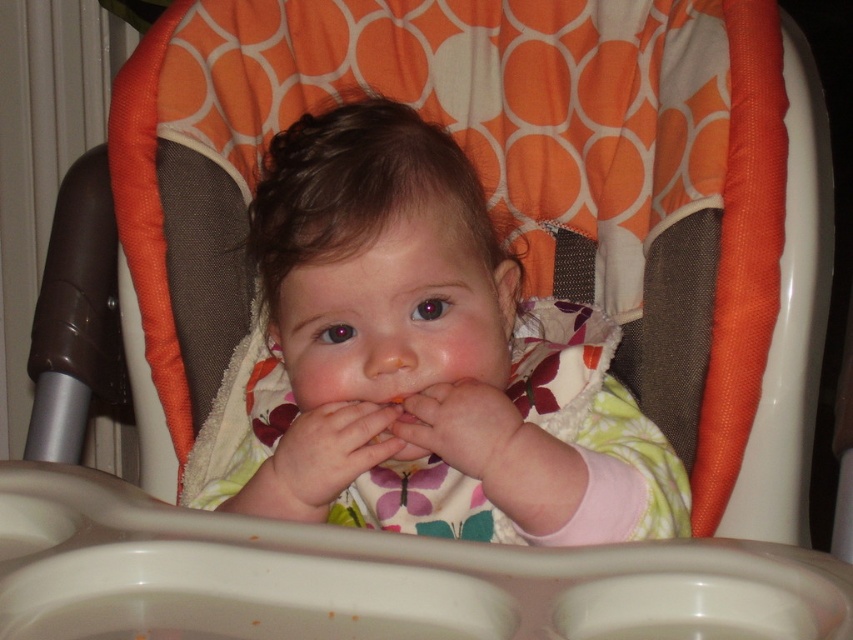
Question: Does floral fabric baby at center appear on the left side of smooth skin hand at center?

Choices:
 (A) no
 (B) yes

Answer: (A)

Question: Which point is closer to the camera?

Choices:
 (A) pale skin at center
 (B) smooth skin hand at center
 (C) floral fabric baby at center

Answer: (C)

Question: Which point appears closest to the camera in this image?

Choices:
 (A) (265, 408)
 (B) (315, 499)
 (C) (509, 481)

Answer: (C)

Question: Considering the relative positions of floral fabric baby at center and smooth skin hand at center in the image provided, where is floral fabric baby at center located with respect to smooth skin hand at center?

Choices:
 (A) above
 (B) below

Answer: (A)

Question: Which object is the closest to the smooth skin hand at center?

Choices:
 (A) floral fabric baby at center
 (B) pale skin at center

Answer: (B)

Question: Is smooth skin hand at center smaller than pale skin at center?

Choices:
 (A) no
 (B) yes

Answer: (A)